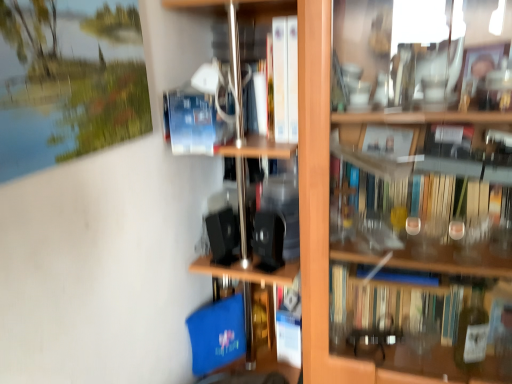
What do you see at coordinates (322, 208) in the screenshot? This screenshot has height=384, width=512. I see `wooden shelf at center` at bounding box center [322, 208].

Locate an element on the screen. white paper at center is located at coordinates (285, 79).

Describe the element at coordinates (285, 79) in the screenshot. This screenshot has height=384, width=512. I see `white paper at center` at that location.

The image size is (512, 384). I want to click on wooden shelf at center, so click(322, 208).

Between wooden shelf at center and blue matte paperback book at center, which one has smaller width?

Thinner between the two is blue matte paperback book at center.

From a real-world perspective, between wooden shelf at center and blue matte paperback book at center, who is vertically lower?

From a 3D spatial view, wooden shelf at center is below.

Measure the distance between wooden shelf at center and blue matte paperback book at center.

wooden shelf at center and blue matte paperback book at center are 32.92 centimeters apart.

Which of these two, wooden shelf at center or blue matte paperback book at center, is bigger?

wooden shelf at center.

From the image's perspective, which is above, blue matte paperback book at center or white paper at center?

white paper at center is shown above in the image.

Is blue matte paperback book at center beside white paper at center?

No.

In the scene shown: Which object is positioned more to the left, blue matte paperback book at center or white paper at center?

blue matte paperback book at center is more to the left.

Measure the distance between blue matte paperback book at center and white paper at center.

blue matte paperback book at center and white paper at center are 7.96 inches apart.

Based on the photo, are wooden shelf at center and white paper at center located far from each other?

No, wooden shelf at center is not far away from white paper at center.

Does wooden shelf at center have a larger size compared to white paper at center?

Yes, wooden shelf at center is bigger than white paper at center.

From the image's perspective, between wooden shelf at center and white paper at center, who is located below?

wooden shelf at center appears lower in the image.

Is point (319, 197) closer or farther from the camera than point (289, 82)?

Point (319, 197).

Is white paper at center outside of wooden shelf at center?

No, white paper at center is not entirely external to wooden shelf at center.

Considering the positions of objects white paper at center and wooden shelf at center in the image provided, who is more to the left, white paper at center or wooden shelf at center?

white paper at center is more to the left.

Based on the photo, from the image's perspective, is white paper at center under wooden shelf at center?

No, from the image's perspective, white paper at center is not below wooden shelf at center.

Does point (213, 152) come behind point (162, 1)?

That is True.

In the image, there is a blue matte paperback book at center. What are the coordinates of `shelf below it (from the image's perspective)` in the screenshot? It's located at (322, 208).

Based on the photo, from a real-world perspective, is blue matte paperback book at center under wooden shelf at center?

No, from a real-world perspective, blue matte paperback book at center is not below wooden shelf at center.

From the picture: Considering the sizes of white paper at center and blue matte paperback book at center in the image, is white paper at center taller or shorter than blue matte paperback book at center?

white paper at center is taller than blue matte paperback book at center.

From a real-world perspective, is white paper at center located beneath blue matte paperback book at center?

No, from a real-world perspective, white paper at center is not below blue matte paperback book at center.

In terms of size, does white paper at center appear bigger or smaller than blue matte paperback book at center?

In the image, white paper at center appears to be smaller than blue matte paperback book at center.

From the image's perspective, which one is positioned higher, white paper at center or blue matte paperback book at center?

white paper at center, from the image's perspective.

Find the location of a particular element. Image resolution: width=512 pixels, height=384 pixels. shelf in front of the blue matte paperback book at center is located at coordinates (322, 208).

This screenshot has height=384, width=512. In order to click on book on the right of blue matte paperback book at center in this screenshot , I will do `click(285, 79)`.

Based on their spatial positions, is blue matte paperback book at center or white paper at center further from wooden shelf at center?

Result: Among the two, blue matte paperback book at center is located further to wooden shelf at center.

From the picture: Considering their positions, is white paper at center positioned further to wooden shelf at center than blue matte paperback book at center?

blue matte paperback book at center lies further to wooden shelf at center than the other object.

From the image, which object appears to be nearer to white paper at center, blue matte paperback book at center or wooden shelf at center?

wooden shelf at center lies closer to white paper at center than the other object.

Estimate the real-world distances between objects in this image. Which object is closer to white paper at center, wooden shelf at center or blue matte paperback book at center?

Among the two, wooden shelf at center is located nearer to white paper at center.

Looking at the image, which one is located further to blue matte paperback book at center, wooden shelf at center or white paper at center?

Among the two, wooden shelf at center is located further to blue matte paperback book at center.

Which object lies nearer to the anchor point blue matte paperback book at center, white paper at center or wooden shelf at center?

Based on the image, white paper at center appears to be nearer to blue matte paperback book at center.

Identify the location of paperback book between white paper at center and wooden shelf at center vertically. (193, 122).